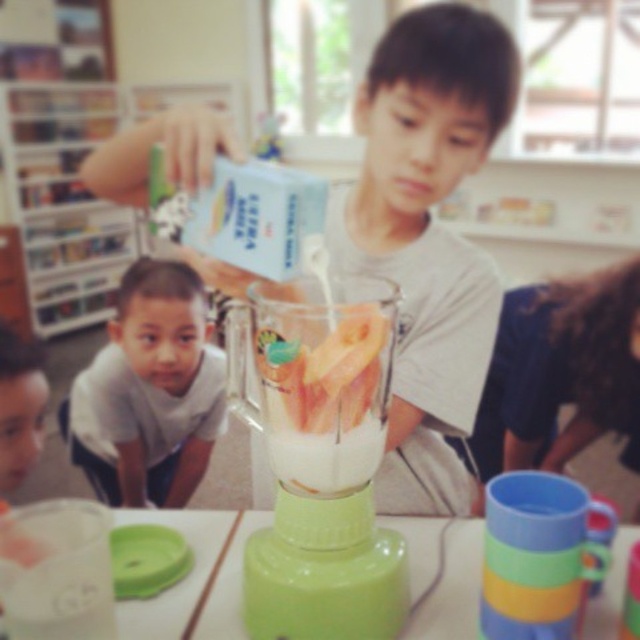
You are a photographer setting up for a group photo. The scene has a matte white shirt at center and a green plastic table at center. Which object is wider?

The matte white shirt at center is wider than the green plastic table at center according to the description.

You are standing at the origin point in the image. Which direction should you move to reach the matte white shirt at center?

The matte white shirt at center is located at coordinates 0.362 on the x axis and 0.670 on the y axis. Since you are at the origin point, you should move towards the right along the x axis and upwards along the y axis to reach it.